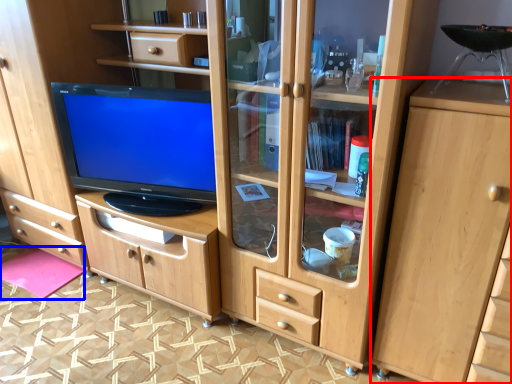
Question: Which of the following is the closest to the observer, cabinetry (highlighted by a red box) or flat (highlighted by a blue box)?

Choices:
 (A) cabinetry
 (B) flat

Answer: (A)